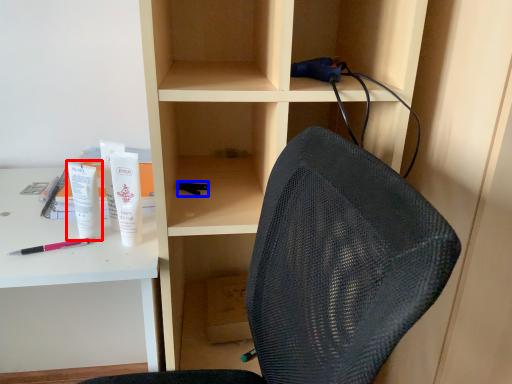
Question: Which point is closer to the camera, stationery (highlighted by a red box) or stationery (highlighted by a blue box)?

Choices:
 (A) stationery
 (B) stationery

Answer: (A)